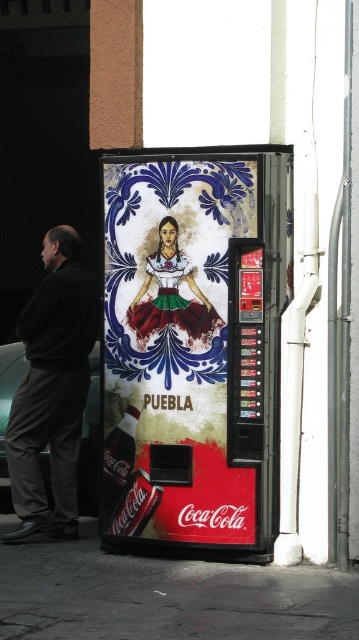
Question: Which of the following is the closest to the observer?

Choices:
 (A) (133, 513)
 (B) (48, 465)
 (C) (16, 564)

Answer: (C)

Question: Does matte plastic vending machine at center have a larger size compared to metallic silver car at lower left?

Choices:
 (A) no
 (B) yes

Answer: (B)

Question: Which point is closer to the camera?

Choices:
 (A) (212, 602)
 (B) (173, 257)
 (C) (112, 444)
 (D) (25, 364)

Answer: (A)

Question: Is matte plastic vending machine at center smaller than matte plastic coca-cola can at center?

Choices:
 (A) no
 (B) yes

Answer: (A)

Question: Is dark gray pants at left closer to camera compared to matte red can at lower center?

Choices:
 (A) no
 (B) yes

Answer: (A)

Question: Which object is farther from the camera taking this photo?

Choices:
 (A) dark gray pants at left
 (B) matte plastic vending machine at center
 (C) metallic silver car at lower left
 (D) smooth concrete pavement at lower center

Answer: (C)